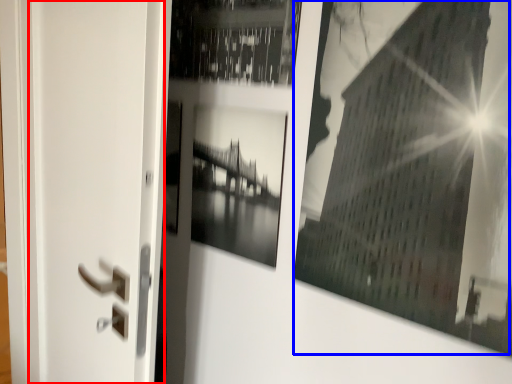
Question: Which object appears closest to the camera in this image, screen door (highlighted by a red box) or picture frame (highlighted by a blue box)?

Choices:
 (A) screen door
 (B) picture frame

Answer: (B)